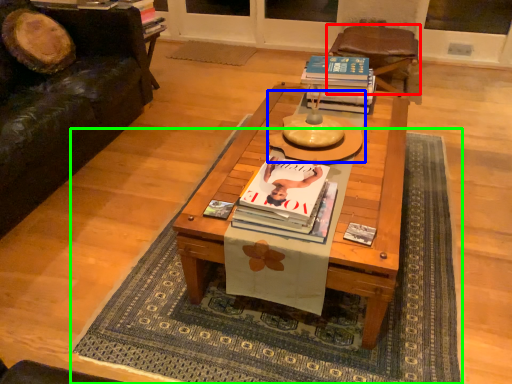
Question: Based on their relative distances, which object is nearer to chair (highlighted by a red box)? Choose from round table (highlighted by a blue box) and mat (highlighted by a green box).

Choices:
 (A) round table
 (B) mat

Answer: (B)